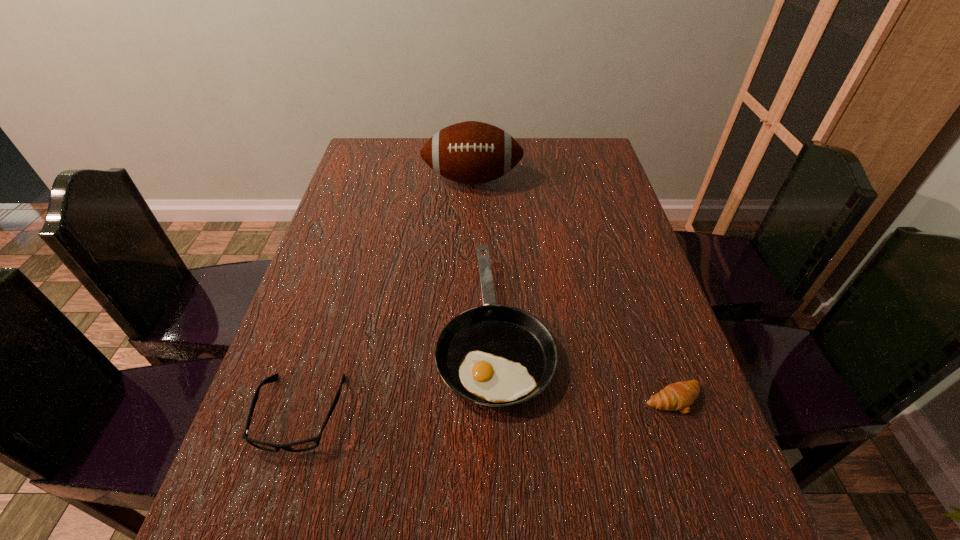
You are a GUI agent. You are given a task and a screenshot of the screen. Output one action in this format:
    pyautogui.click(x=<x>, y=<y>)
    Task: Click on the farthest object
    
    Given the screenshot: What is the action you would take?
    pyautogui.click(x=471, y=152)

Find the location of a particular element. the tallest object is located at coordinates (471, 152).

This screenshot has height=540, width=960. Identify the location of the second tallest object. (493, 355).

Identify the location of the leftmost object. (300, 446).

You are a GUI agent. You are given a task and a screenshot of the screen. Output one action in this format:
    pyautogui.click(x=<x>, y=<y>)
    Task: Click on the spectacles
    The image size is (960, 540).
    Given the screenshot: What is the action you would take?
    pyautogui.click(x=300, y=446)

Locate an element on the screen. crescent roll is located at coordinates (677, 396).

Image resolution: width=960 pixels, height=540 pixels. Identify the location of the shortest object. (677, 396).

You are a GUI agent. You are given a task and a screenshot of the screen. Output one action in this format:
    pyautogui.click(x=<x>, y=<y>)
    Task: Click on the vacant space located on the laces of the farthest object
    
    Given the screenshot: What is the action you would take?
    pyautogui.click(x=470, y=261)

You are a GUI agent. You are given a task and a screenshot of the screen. Output one action in this format:
    pyautogui.click(x=<x>, y=<y>)
    Task: Click on the vacant space located 0.290m on the back of the frying pan
    Image resolution: width=960 pixels, height=540 pixels.
    Given the screenshot: What is the action you would take?
    [491, 195]

At what (x,y) coordinates should I click in order to perform the action: click on free location located 0.050m on the front-facing side of the second shortest object. Please return your answer as a coordinate pair (x, y). Looking at the image, I should click on (277, 487).